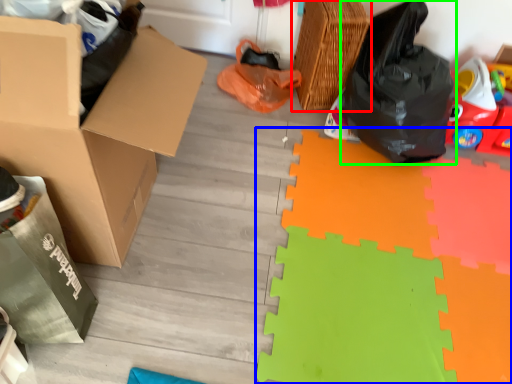
Question: Estimate the real-world distances between objects in this image. Which object is closer to basket (highlighted by a red box), doormat (highlighted by a blue box) or plastic bag (highlighted by a green box)?

Choices:
 (A) doormat
 (B) plastic bag

Answer: (B)